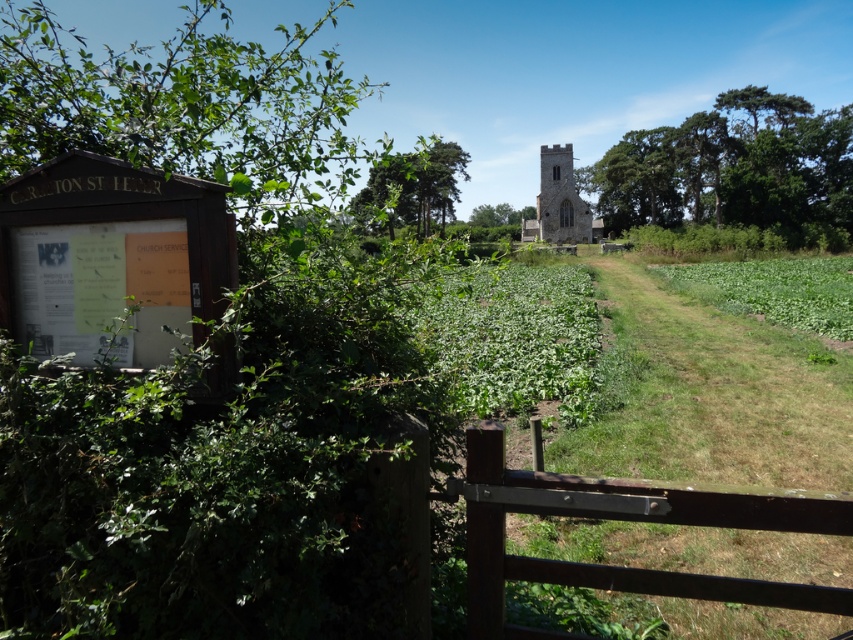
Who is more forward, (432, 184) or (560, 214)?

Point (432, 184)

Is point (397, 177) more distant than point (590, 228)?

No, it is not.

The height and width of the screenshot is (640, 853). I want to click on green leafy tree at center, so click(x=412, y=188).

Is brown wooden gate at lower center further to the viewer compared to green leafy tree at center?

No.

Which of these two, brown wooden gate at lower center or green leafy tree at center, stands shorter?

brown wooden gate at lower center is shorter.

The image size is (853, 640). Find the location of `brown wooden gate at lower center`. brown wooden gate at lower center is located at coordinates (627, 518).

Based on the photo, is green leafy tree at upper right closer to the viewer compared to green leafy tree at center?

No, green leafy tree at upper right is further to the viewer.

Which is in front, point (840, 244) or point (399, 204)?

Point (840, 244) is more forward.

Does point (828, 144) come behind point (422, 179)?

Yes.

Locate an element on the screen. green leafy tree at upper right is located at coordinates (735, 170).